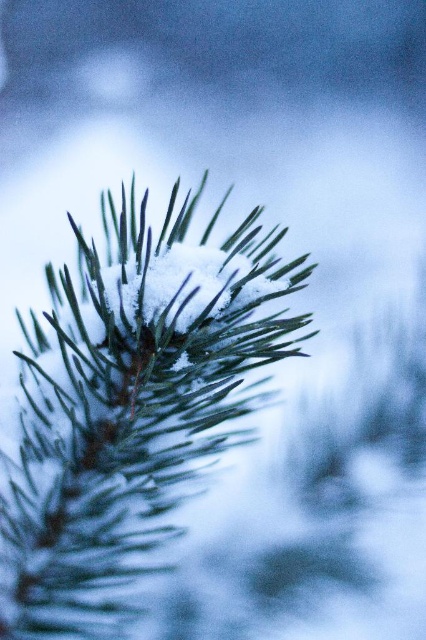
Question: Does green matte fir tree at center have a smaller size compared to white fluffy snow at center?

Choices:
 (A) no
 (B) yes

Answer: (A)

Question: Among these objects, which one is nearest to the camera?

Choices:
 (A) white fluffy snow at center
 (B) green matte fir tree at center

Answer: (B)

Question: Can you confirm if green matte fir tree at center is positioned below white fluffy snow at center?

Choices:
 (A) no
 (B) yes

Answer: (B)

Question: Which of the following is the closest to the observer?

Choices:
 (A) green matte fir tree at center
 (B) white fluffy snow at center

Answer: (A)

Question: Where is green matte fir tree at center located in relation to white fluffy snow at center in the image?

Choices:
 (A) left
 (B) right

Answer: (A)